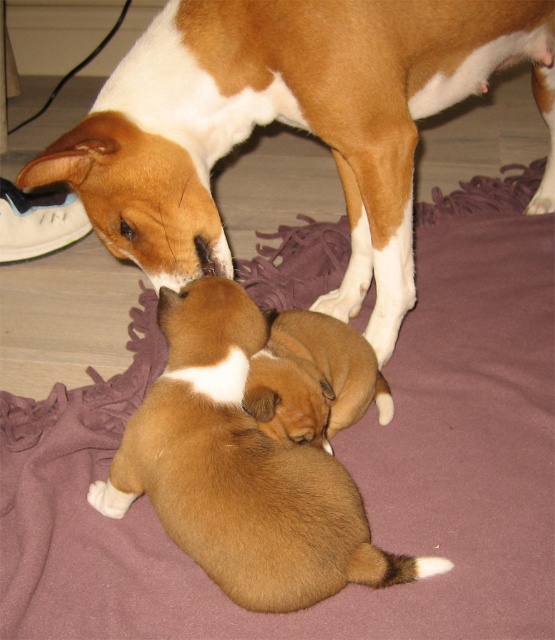
At what (x,y) coordinates should I click in order to perform the action: click on brown furry puppies at lower center. Please return your answer as a coordinate pair (x, y). Looking at the image, I should click on (240, 468).

Measure the distance from brown furry puppies at lower center to brown furry puppy at center.

13.88 centimeters

Which is behind, point (234, 413) or point (374, 365)?

Point (374, 365)

Locate an element on the screen. The image size is (555, 640). brown furry puppies at lower center is located at coordinates (240, 468).

Is brown matte dog at center wider than brown furry puppies at lower center?

Correct, the width of brown matte dog at center exceeds that of brown furry puppies at lower center.

Is the position of brown matte dog at center less distant than that of brown furry puppies at lower center?

No, it is behind brown furry puppies at lower center.

Based on the photo, who is more forward, (365, 244) or (214, 384)?

Point (214, 384)

Identify the location of brown matte dog at center. (290, 124).

Is brown matte dog at center positioned behind brown furry puppy at center?

Yes, brown matte dog at center is further from the viewer.

Who is shorter, brown matte dog at center or brown furry puppy at center?

brown furry puppy at center

You are a GUI agent. You are given a task and a screenshot of the screen. Output one action in this format:
    pyautogui.click(x=<x>, y=<y>)
    Task: Click on the brown matte dog at center
    
    Given the screenshot: What is the action you would take?
    pyautogui.click(x=290, y=124)